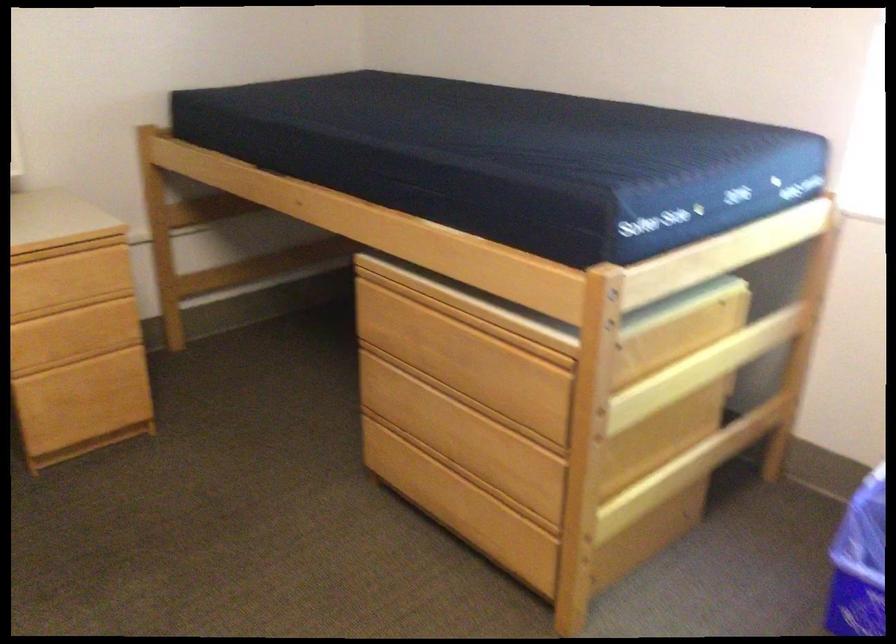
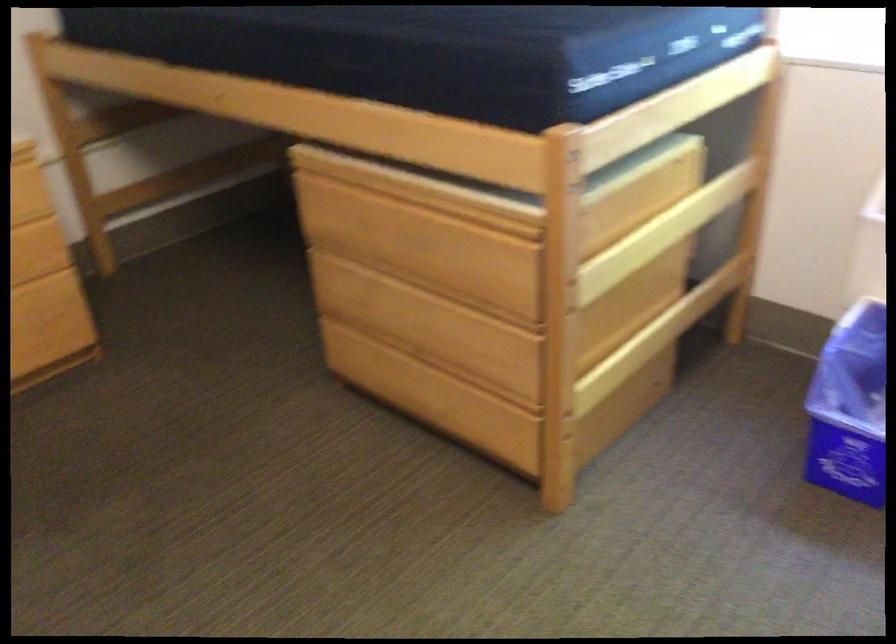
In a continuous first-person perspective shot, in which direction is the camera moving?

The cameraman moved toward left, forward.